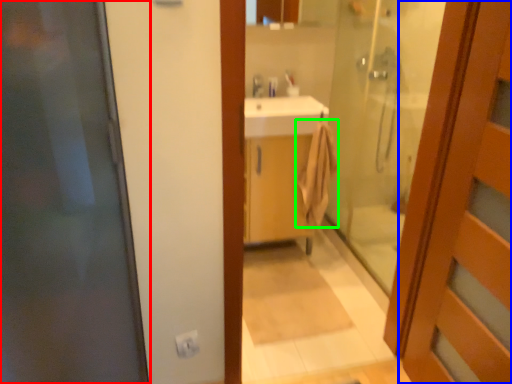
Question: Estimate the real-world distances between objects in this image. Which object is closer to door (highlighted by a red box), door (highlighted by a blue box) or bath towel (highlighted by a green box)?

Choices:
 (A) door
 (B) bath towel

Answer: (A)